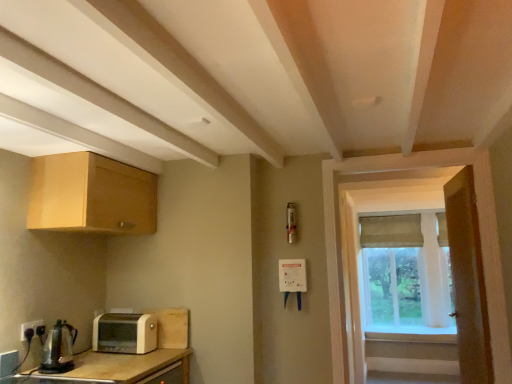
Question: From the image's perspective, is green fabric curtain at right located above or below light wood cabinet at upper left?

Choices:
 (A) below
 (B) above

Answer: (A)

Question: Is point (408, 324) positioned closer to the camera than point (154, 211)?

Choices:
 (A) farther
 (B) closer

Answer: (A)

Question: Estimate the real-world distances between objects in this image. Which object is closer to the beige fabric curtain at window?

Choices:
 (A) white plastic toaster at lower left
 (B) green fabric curtain at right
 (C) wooden door at right
 (D) wooden screen door at right
 (E) black plastic electrical outlet at lower left

Answer: (B)

Question: Considering the real-world distances, which object is farthest from the white plastic toaster at lower left?

Choices:
 (A) green fabric curtain at right
 (B) light wood cabinet at upper left
 (C) wooden door at right
 (D) black plastic electrical outlet at lower left
 (E) beige fabric curtain at window

Answer: (E)